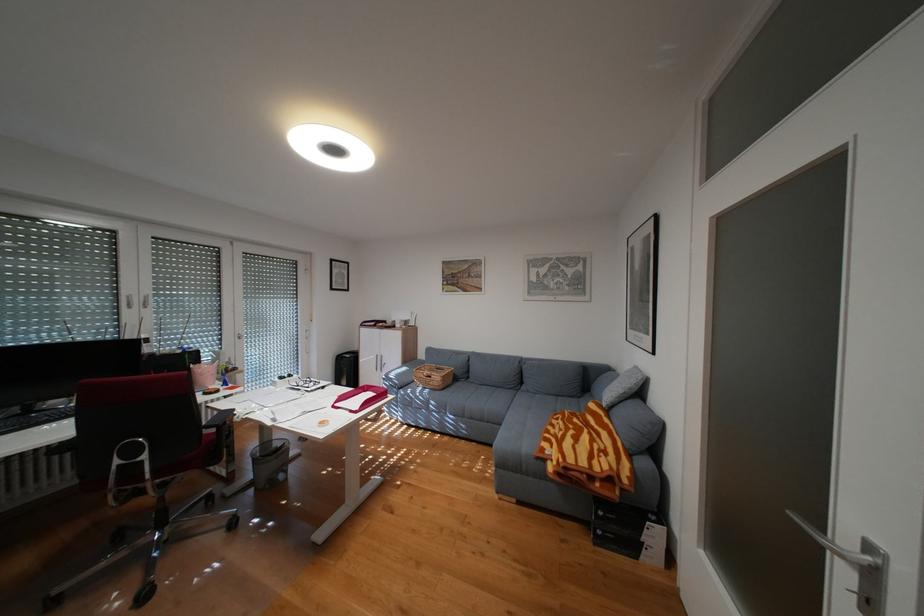
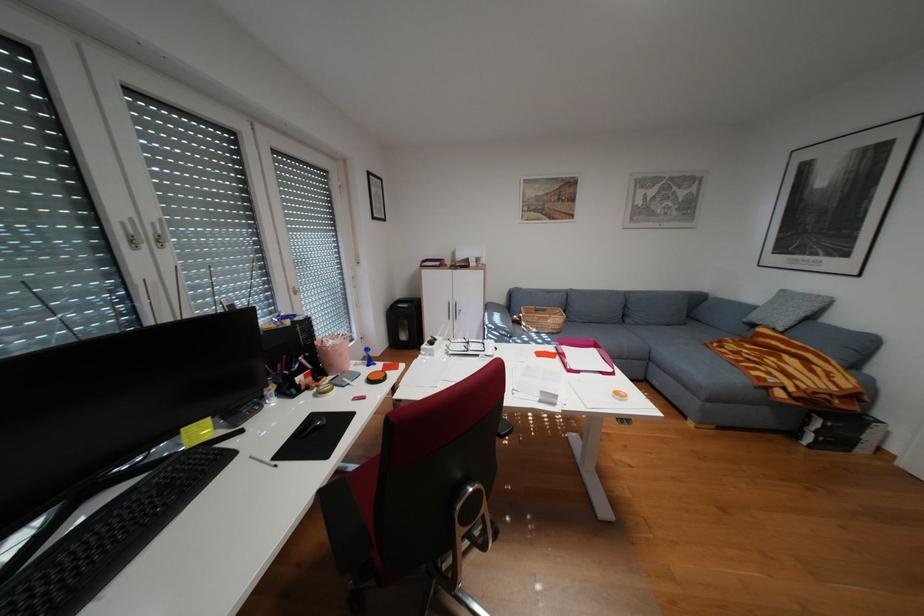
What movement of the cameraman would produce the second image?

The cameraman moved toward left, forward.